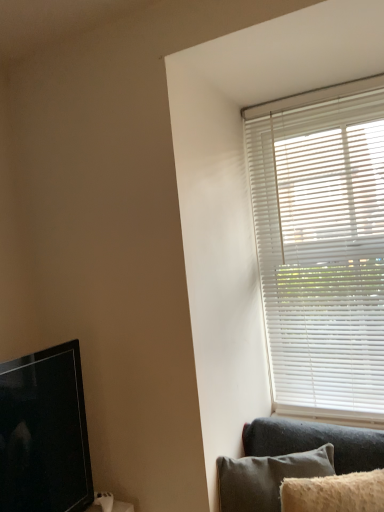
Question: Is white matte blinds at upper right to the left of fuzzy beige pillow at lower right from the viewer's perspective?

Choices:
 (A) yes
 (B) no

Answer: (B)

Question: Is white matte blinds at upper right wider than fuzzy beige pillow at lower right?

Choices:
 (A) no
 (B) yes

Answer: (B)

Question: Could you tell me if white matte blinds at upper right is facing fuzzy beige pillow at lower right?

Choices:
 (A) yes
 (B) no

Answer: (A)

Question: From the image's perspective, would you say white matte blinds at upper right is shown under fuzzy beige pillow at lower right?

Choices:
 (A) no
 (B) yes

Answer: (A)

Question: From a real-world perspective, is white matte blinds at upper right physically above fuzzy beige pillow at lower right?

Choices:
 (A) yes
 (B) no

Answer: (A)

Question: Can you confirm if white matte blinds at upper right is thinner than fuzzy beige pillow at lower right?

Choices:
 (A) no
 (B) yes

Answer: (A)

Question: Is fuzzy beige pillow at lower right positioned with its back to white matte blinds at upper right?

Choices:
 (A) yes
 (B) no

Answer: (B)

Question: Would you say fuzzy beige pillow at lower right is outside white matte blinds at upper right?

Choices:
 (A) yes
 (B) no

Answer: (A)

Question: Is fuzzy beige pillow at lower right positioned in front of white matte blinds at upper right?

Choices:
 (A) no
 (B) yes

Answer: (B)

Question: Is white matte blinds at upper right a part of fuzzy beige pillow at lower right?

Choices:
 (A) no
 (B) yes

Answer: (A)

Question: Can you confirm if fuzzy beige pillow at lower right is taller than white matte blinds at upper right?

Choices:
 (A) no
 (B) yes

Answer: (A)

Question: From the image's perspective, is fuzzy beige pillow at lower right below white matte blinds at upper right?

Choices:
 (A) no
 (B) yes

Answer: (B)

Question: Does black glossy tv at left appear on the left side of fuzzy beige pillow at lower right?

Choices:
 (A) yes
 (B) no

Answer: (A)